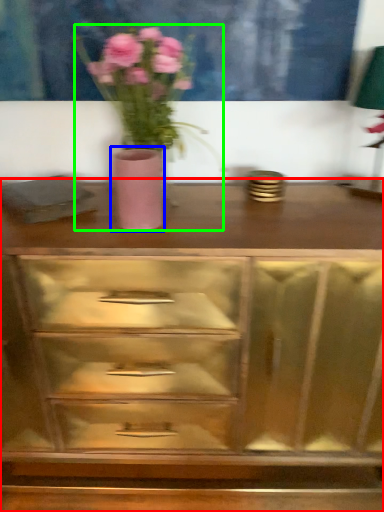
Question: Which is nearer to the chest of drawers (highlighted by a red box)? vase (highlighted by a blue box) or floral arrangement (highlighted by a green box).

Choices:
 (A) vase
 (B) floral arrangement

Answer: (B)